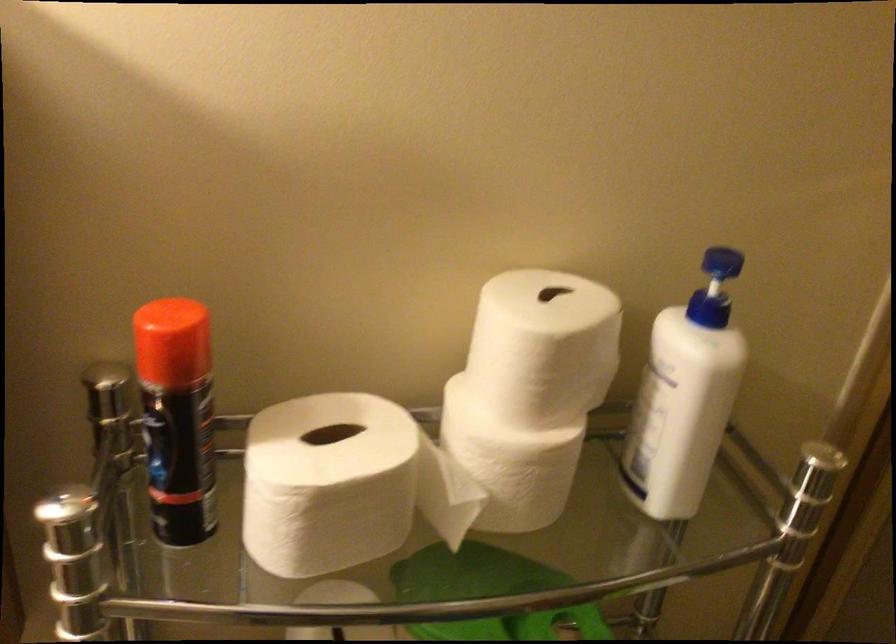
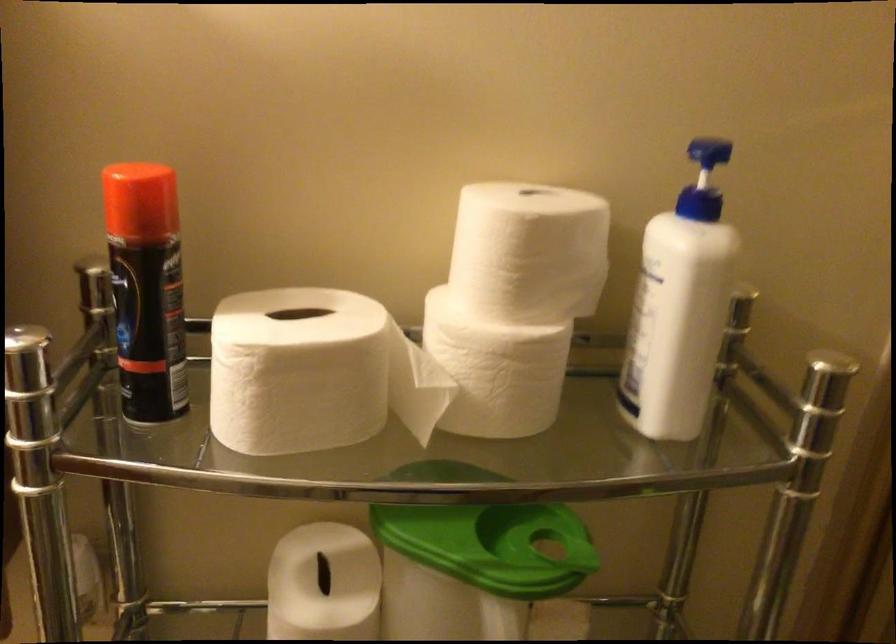
Question: Which direction would the cameraman need to move to produce the second image? Reply with the corresponding letter.

Choices:
 (A) Left
 (B) Right
 (C) Forward
 (D) Backward

Answer: (B)